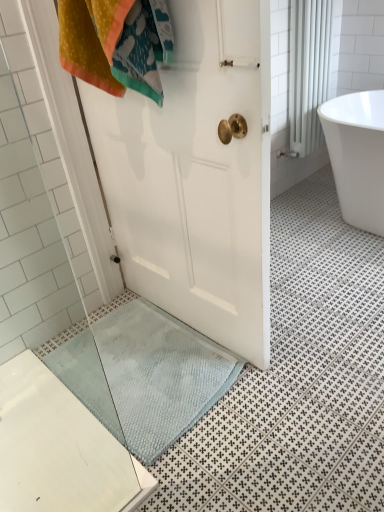
Question: Would you consider white glossy radiator at upper right to be distant from white glossy bathtub at upper right?

Choices:
 (A) yes
 (B) no

Answer: (B)

Question: From the image's perspective, is white glossy radiator at upper right on white glossy bathtub at upper right?

Choices:
 (A) yes
 (B) no

Answer: (A)

Question: Does white glossy radiator at upper right have a smaller size compared to white glossy bathtub at upper right?

Choices:
 (A) no
 (B) yes

Answer: (B)

Question: Is white glossy radiator at upper right positioned beyond the bounds of white glossy bathtub at upper right?

Choices:
 (A) yes
 (B) no

Answer: (A)

Question: Is white glossy radiator at upper right wider than white glossy bathtub at upper right?

Choices:
 (A) yes
 (B) no

Answer: (B)

Question: Considering the positions of white glossy bathtub at upper right and white glossy radiator at upper right in the image, is white glossy bathtub at upper right wider or thinner than white glossy radiator at upper right?

Choices:
 (A) thin
 (B) wide

Answer: (B)

Question: From a real-world perspective, relative to white glossy radiator at upper right, is white glossy bathtub at upper right vertically above or below?

Choices:
 (A) above
 (B) below

Answer: (B)

Question: Considering the positions of white glossy bathtub at upper right and white glossy radiator at upper right in the image, is white glossy bathtub at upper right taller or shorter than white glossy radiator at upper right?

Choices:
 (A) tall
 (B) short

Answer: (B)

Question: Is point (360, 216) positioned closer to the camera than point (336, 69)?

Choices:
 (A) closer
 (B) farther

Answer: (A)

Question: Looking at their shapes, would you say white glossy radiator at upper right is wider or thinner than blue textured bath mat at lower center?

Choices:
 (A) thin
 (B) wide

Answer: (A)

Question: Considering the positions of white glossy radiator at upper right and blue textured bath mat at lower center in the image, is white glossy radiator at upper right bigger or smaller than blue textured bath mat at lower center?

Choices:
 (A) big
 (B) small

Answer: (A)

Question: Considering the positions of white glossy radiator at upper right and blue textured bath mat at lower center in the image, is white glossy radiator at upper right taller or shorter than blue textured bath mat at lower center?

Choices:
 (A) tall
 (B) short

Answer: (A)

Question: Considering their positions, is white glossy radiator at upper right located in front of or behind blue textured bath mat at lower center?

Choices:
 (A) behind
 (B) front

Answer: (A)

Question: Is blue textured bath mat at lower center inside the boundaries of white glossy bathtub at upper right, or outside?

Choices:
 (A) outside
 (B) inside

Answer: (A)

Question: Relative to white glossy bathtub at upper right, is blue textured bath mat at lower center in front or behind?

Choices:
 (A) front
 (B) behind

Answer: (A)